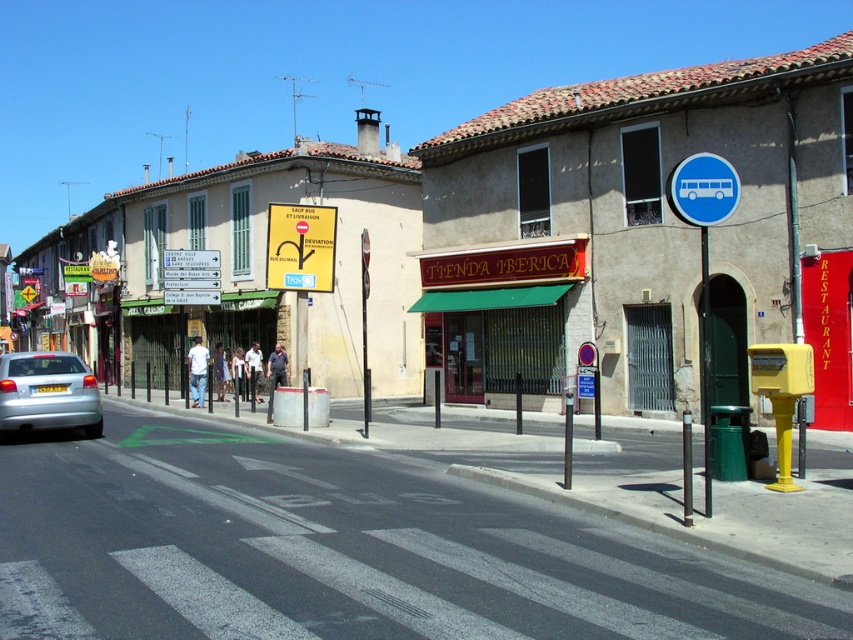
How distant is denim pants at center from yellow plastic sign at upper center?

4.32 feet

Does denim pants at center have a greater height compared to yellow plastic sign at upper center?

Indeed, denim pants at center has a greater height compared to yellow plastic sign at upper center.

Does point (202, 378) come closer to viewer compared to point (187, 301)?

Yes.

In order to click on denim pants at center in this screenshot , I will do point(196,371).

Who is more distant from viewer, (497, 321) or (215, 300)?

The point (215, 300) is more distant.

Does green awning at center appear on the right side of yellow plastic sign at upper center?

Correct, you'll find green awning at center to the right of yellow plastic sign at upper center.

You are a GUI agent. You are given a task and a screenshot of the screen. Output one action in this format:
    pyautogui.click(x=<x>, y=<y>)
    Task: Click on the green awning at center
    
    Given the screenshot: What is the action you would take?
    pyautogui.click(x=498, y=316)

Can you confirm if yellow paper sign at upper center is positioned below dark blue shirt at center?

Incorrect, yellow paper sign at upper center is not positioned below dark blue shirt at center.

Can you confirm if yellow paper sign at upper center is positioned above dark blue shirt at center?

Yes.

The width and height of the screenshot is (853, 640). What are the coordinates of `yellow paper sign at upper center` in the screenshot? It's located at (190, 259).